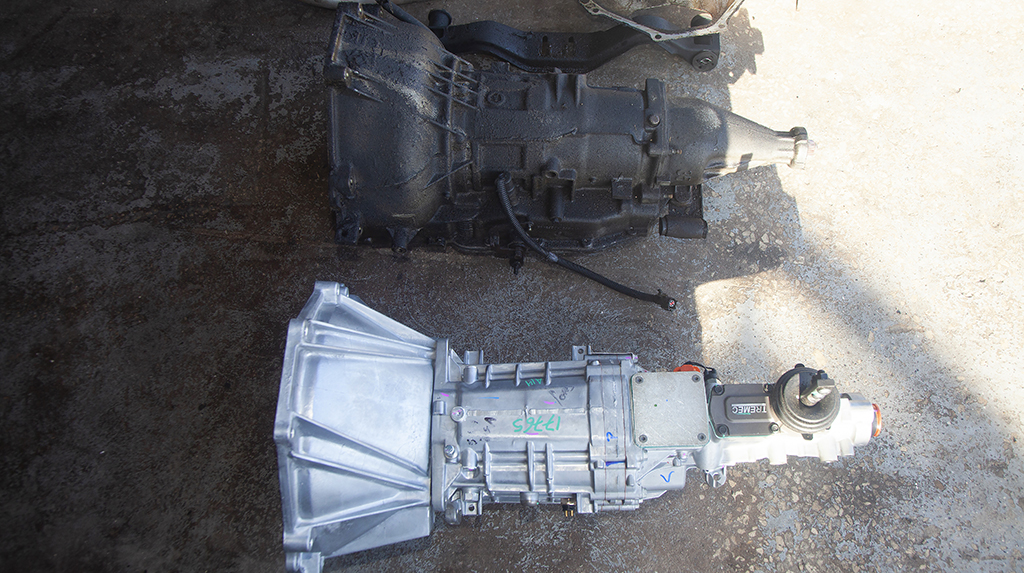
Where is `floor`? This screenshot has width=1024, height=573. floor is located at coordinates (182, 358).